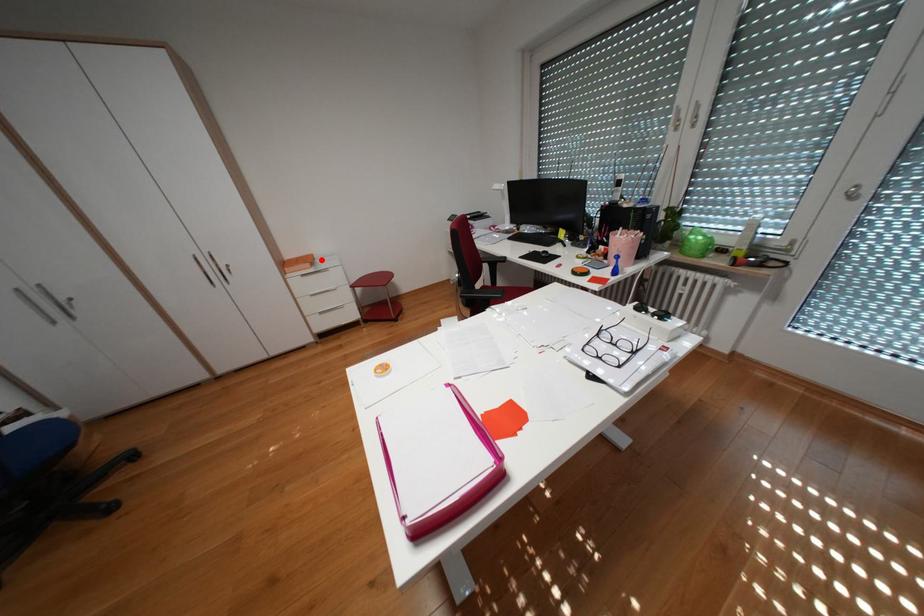
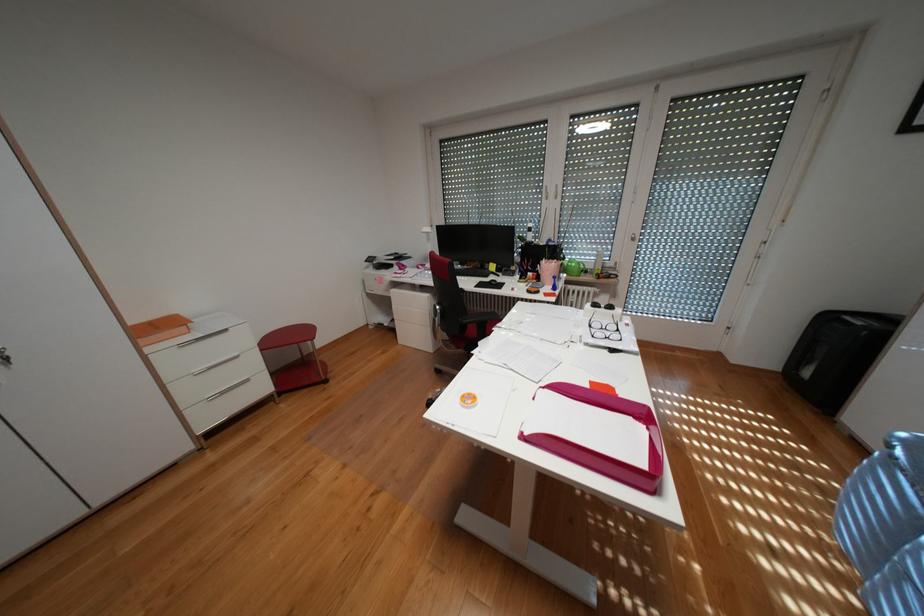
Question: I am providing you with two images of the same scene from different viewpoints. In image1, a red point is highlighted. Considering the same 3D point in image2, which of the following is correct?

Choices:
 (A) It is closer
 (B) It is farther

Answer: (B)